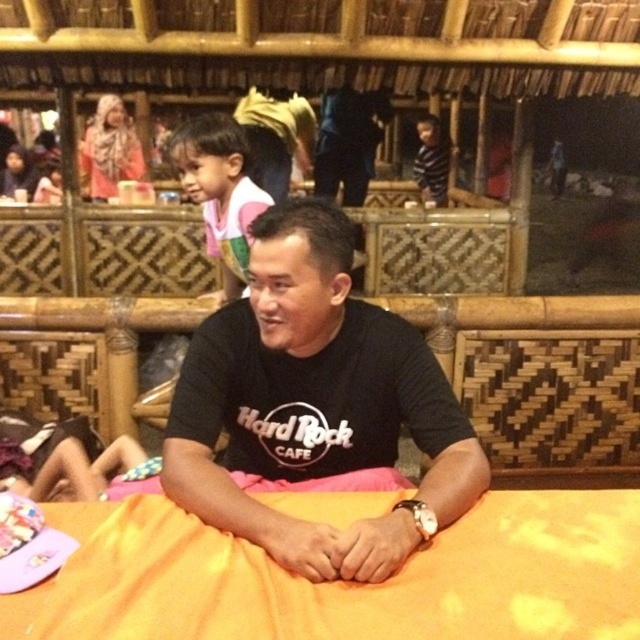
Who is positioned more to the right, orange fabric bed at center or pink cotton shirt at upper left?

Positioned to the right is orange fabric bed at center.

Is point (113, 305) positioned in front of point (236, 212)?

That is True.

Which is in front, point (616, 493) or point (225, 116)?

Point (616, 493)

At what (x,y) coordinates should I click in order to perform the action: click on orange fabric bed at center. Please return your answer as a coordinate pair (x, y). Looking at the image, I should click on (344, 582).

Image resolution: width=640 pixels, height=640 pixels. What do you see at coordinates (314, 404) in the screenshot?
I see `black matte shirt at center` at bounding box center [314, 404].

Is black matte shirt at center shorter than pink cotton shirt at upper left?

Indeed, black matte shirt at center has a lesser height compared to pink cotton shirt at upper left.

In the scene shown: Measure the distance between black matte shirt at center and camera.

black matte shirt at center and camera are 37.01 inches apart.

Image resolution: width=640 pixels, height=640 pixels. Find the location of `black matte shirt at center`. black matte shirt at center is located at coordinates (314, 404).

The image size is (640, 640). What do you see at coordinates (344, 582) in the screenshot? I see `orange fabric bed at center` at bounding box center [344, 582].

Between orange fabric bed at center and black matte shirt at center, which one appears on the left side from the viewer's perspective?

black matte shirt at center is more to the left.

Find the location of a particular element. The image size is (640, 640). orange fabric bed at center is located at coordinates (344, 582).

Identify the location of orange fabric bed at center. (344, 582).